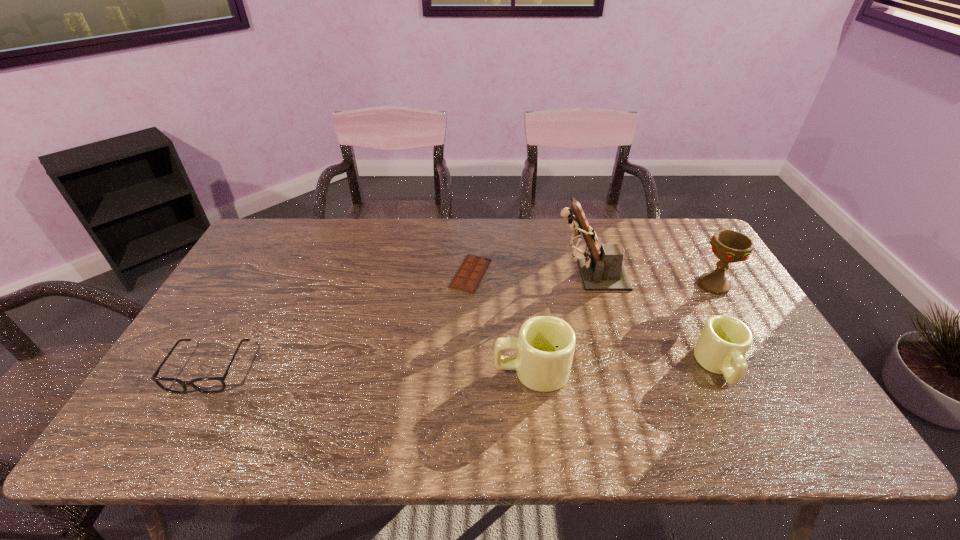
Locate an element on the screen. spectacles is located at coordinates coord(209,385).

Where is `vacant space located with the handle on the side of the left mug`? This screenshot has width=960, height=540. vacant space located with the handle on the side of the left mug is located at coordinates (409, 371).

Where is `free point located 0.060m with the handle on the side of the left mug`? The height and width of the screenshot is (540, 960). free point located 0.060m with the handle on the side of the left mug is located at coordinates click(x=469, y=371).

This screenshot has height=540, width=960. What are the coordinates of `free space located 0.380m with the handle on the side of the left mug` in the screenshot? It's located at (341, 371).

I want to click on vacant space situated 0.180m on the front of the shortest object, so click(468, 340).

Find the location of `vacant area situated 0.190m on the left of the fifth shortest object`. vacant area situated 0.190m on the left of the fifth shortest object is located at coordinates (633, 285).

Where is `vacant area situated on the front-facing side of the tallest object`? vacant area situated on the front-facing side of the tallest object is located at coordinates (463, 275).

At what (x,y) coordinates should I click in order to perform the action: click on free space located 0.050m on the front-facing side of the tallest object. Please return your answer as a coordinate pair (x, y). Looking at the image, I should click on (537, 275).

Locate an element on the screen. The height and width of the screenshot is (540, 960). blank area located on the front-facing side of the tallest object is located at coordinates (537, 275).

The width and height of the screenshot is (960, 540). Identify the location of chocolate bar that is at the far edge. (468, 277).